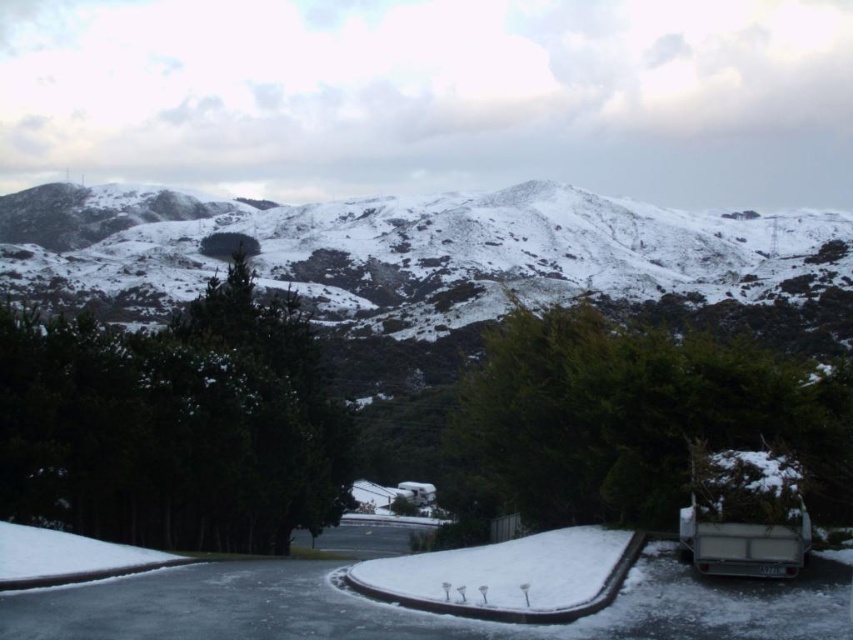
Which is above, green matte tree at center or green textured tree at center?

green matte tree at center

Is green matte tree at center below green textured tree at center?

No.

What are the coordinates of `green matte tree at center` in the screenshot? It's located at (173, 424).

This screenshot has height=640, width=853. What are the coordinates of `snowy rock formation at upper center` in the screenshot? It's located at (410, 259).

Can you confirm if snowy rock formation at upper center is bigger than green textured tree at center?

Yes, snowy rock formation at upper center is bigger than green textured tree at center.

This screenshot has width=853, height=640. Describe the element at coordinates (410, 259) in the screenshot. I see `snowy rock formation at upper center` at that location.

At what (x,y) coordinates should I click in order to perform the action: click on snowy rock formation at upper center. Please return your answer as a coordinate pair (x, y). This screenshot has height=640, width=853. Looking at the image, I should click on (410, 259).

Who is positioned more to the right, snowy rock formation at upper center or green matte tree at center?

green matte tree at center

Does snowy rock formation at upper center appear on the left side of green matte tree at center?

Yes, snowy rock formation at upper center is to the left of green matte tree at center.

Where is `snowy rock formation at upper center`? This screenshot has height=640, width=853. snowy rock formation at upper center is located at coordinates (410, 259).

The width and height of the screenshot is (853, 640). What are the coordinates of `snowy rock formation at upper center` in the screenshot? It's located at (410, 259).